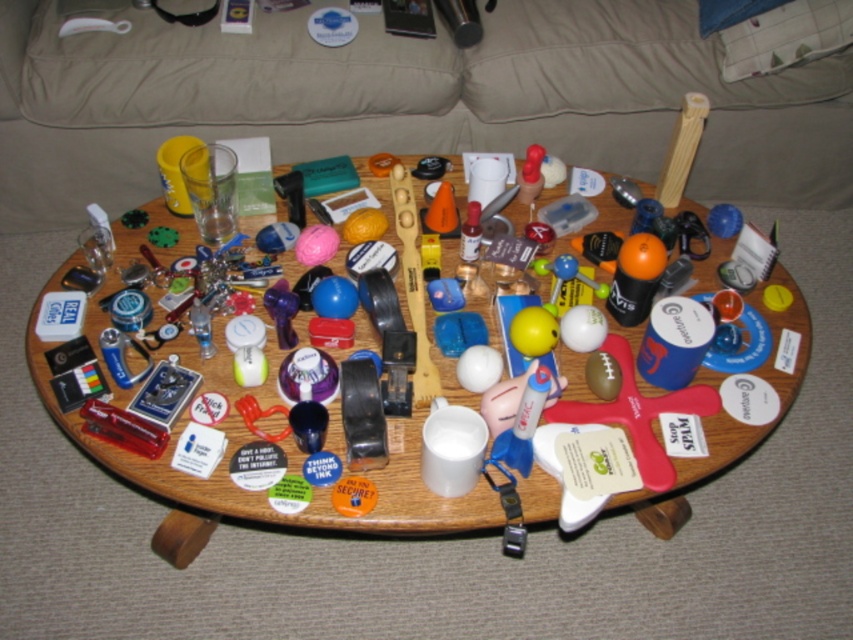
Who is taller, beige fabric couch at upper center or wooden table at center?

wooden table at center

This screenshot has width=853, height=640. Identify the location of beige fabric couch at upper center. (407, 100).

The image size is (853, 640). Identify the location of beige fabric couch at upper center. (407, 100).